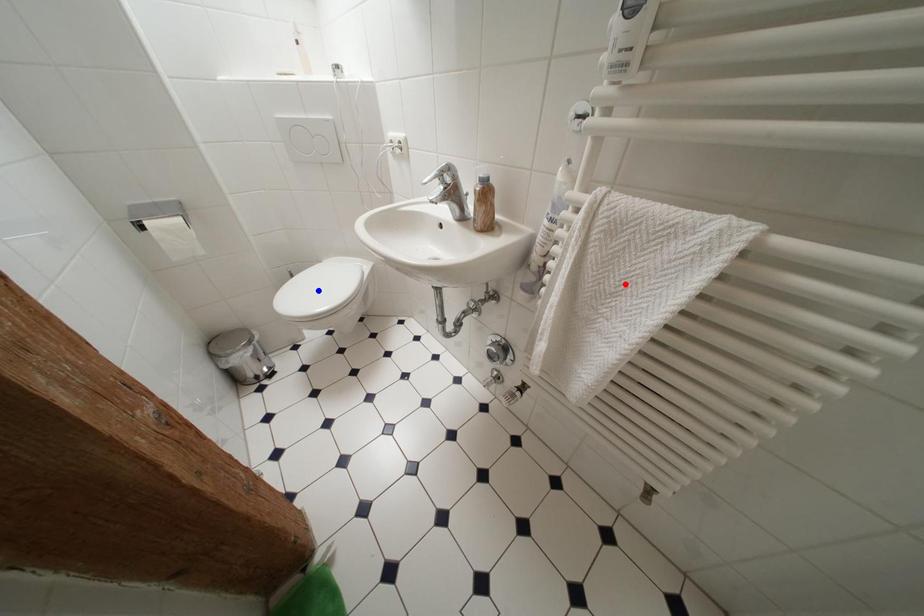
Question: In the image, two points are highlighted. Which point is nearer to the camera? Reply with the corresponding letter.

Choices:
 (A) blue point
 (B) red point

Answer: (B)